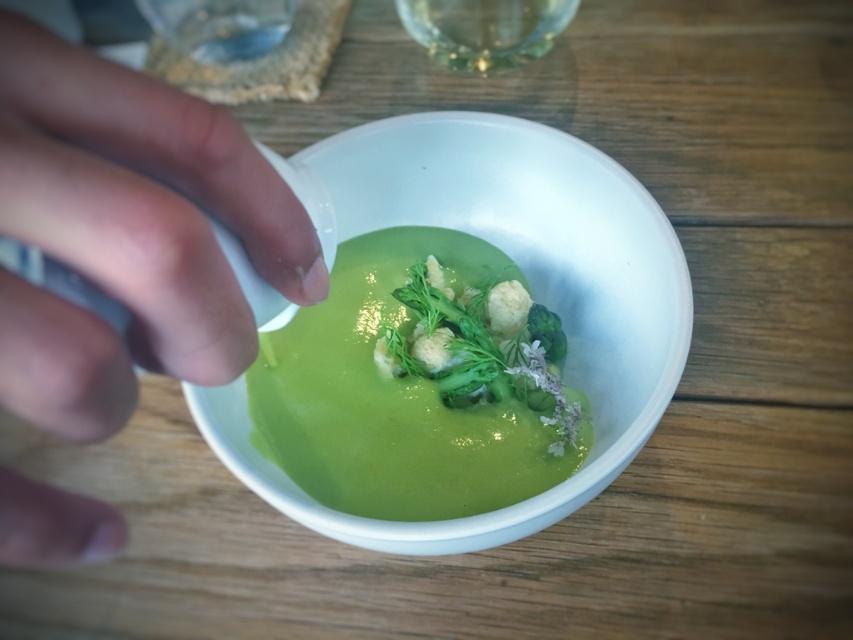
Who is positioned more to the left, matte white hand at left or green matte asparagus at center?

From the viewer's perspective, matte white hand at left appears more on the left side.

Is matte white hand at left bigger than green matte asparagus at center?

Correct, matte white hand at left is larger in size than green matte asparagus at center.

Between point (241, 141) and point (543, 371), which one is positioned in front?

Point (241, 141) is more forward.

I want to click on matte white hand at left, so click(x=144, y=198).

Measure the distance from green creamy soup at center to green matte asparagus at center.

2.84 centimeters

Can you confirm if green creamy soup at center is positioned to the left of green matte asparagus at center?

Yes, green creamy soup at center is to the left of green matte asparagus at center.

Is point (338, 454) closer to camera compared to point (427, 323)?

Yes, it is in front of point (427, 323).

Image resolution: width=853 pixels, height=640 pixels. I want to click on green creamy soup at center, so click(x=392, y=401).

Between matte white hand at left and white glossy bowl at center, which one has less height?

matte white hand at left

This screenshot has width=853, height=640. Describe the element at coordinates (144, 198) in the screenshot. I see `matte white hand at left` at that location.

Image resolution: width=853 pixels, height=640 pixels. What do you see at coordinates (144, 198) in the screenshot? I see `matte white hand at left` at bounding box center [144, 198].

The width and height of the screenshot is (853, 640). What are the coordinates of `matte white hand at left` in the screenshot? It's located at (144, 198).